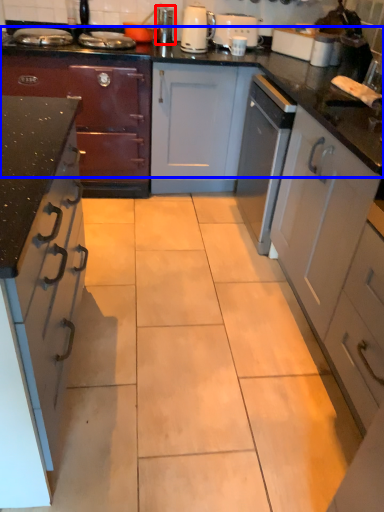
Question: Among these objects, which one is farthest to the camera, appliance (highlighted by a red box) or countertop (highlighted by a blue box)?

Choices:
 (A) appliance
 (B) countertop

Answer: (A)